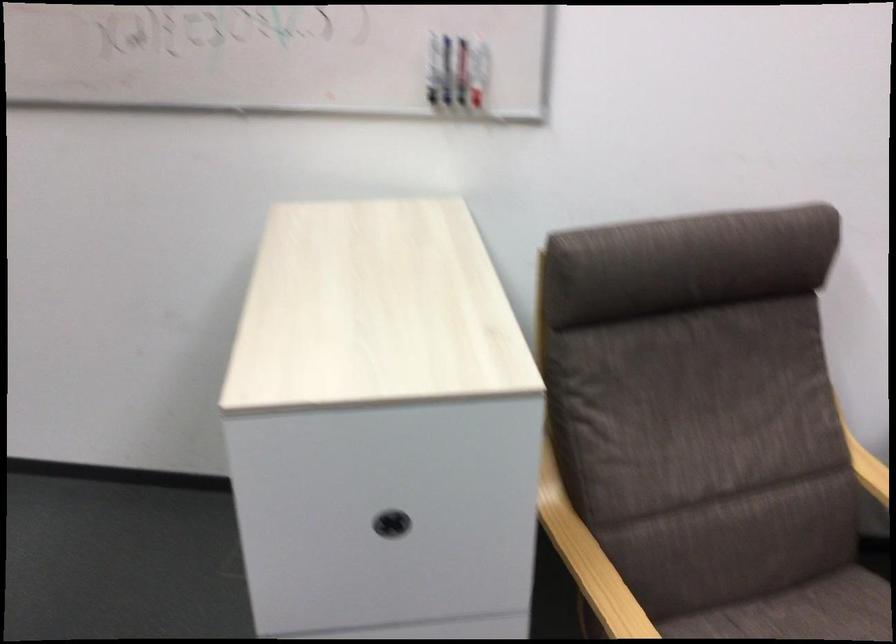
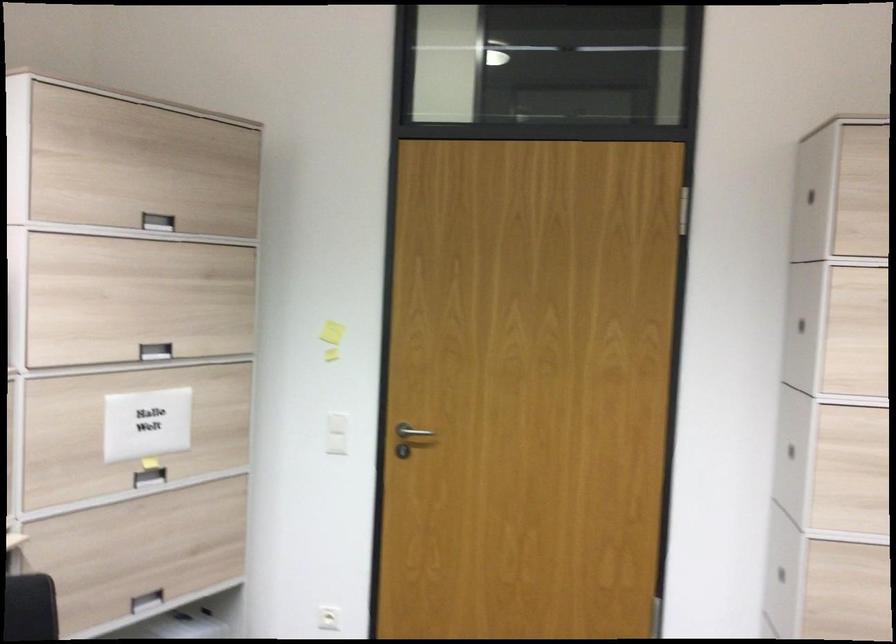
Question: The camera is either moving clockwise (left) or counter-clockwise (right) around the object. The first image is from the beginning of the video and the second image is from the end. Is the camera moving left or right when shooting the video?

Choices:
 (A) Left
 (B) Right

Answer: (B)